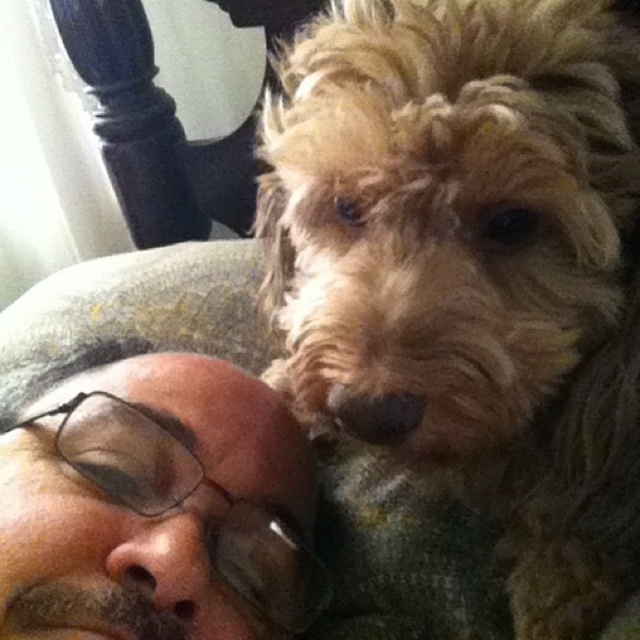
Can you confirm if fuzzy golden fur at center is shorter than brown matte glasses at upper left?

In fact, fuzzy golden fur at center may be taller than brown matte glasses at upper left.

Is fuzzy golden fur at center wider than brown matte glasses at upper left?

Yes.

Who is more distant from viewer, [289,61] or [109,596]?

Positioned behind is point [289,61].

Where is `fuzzy golden fur at center`? fuzzy golden fur at center is located at coordinates (470, 266).